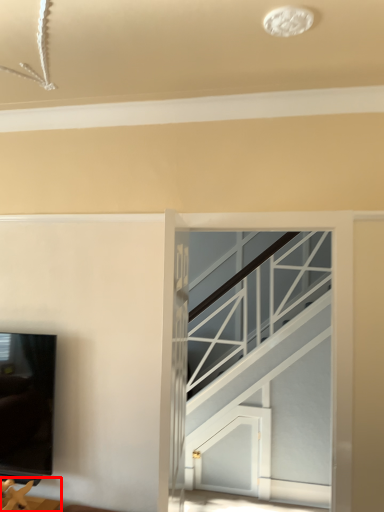
Question: From the image, what is the correct spatial relationship of furniture (annotated by the red box) in relation to glass door?

Choices:
 (A) right
 (B) left

Answer: (B)